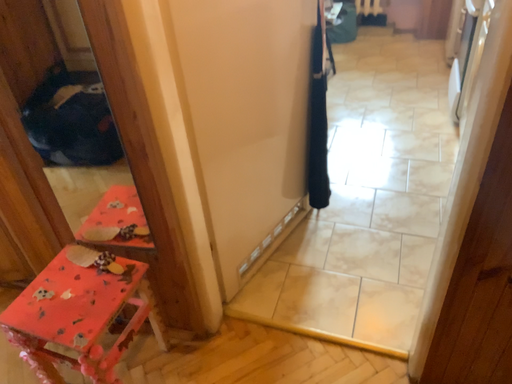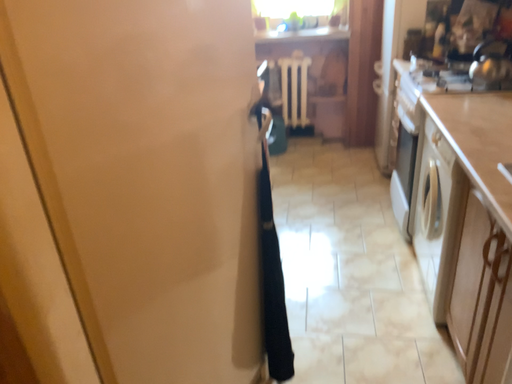
Question: How did the camera likely rotate when shooting the video?

Choices:
 (A) rotated downward
 (B) rotated upward

Answer: (B)